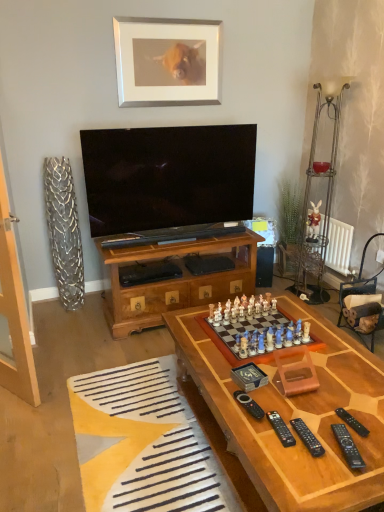
Identify the location of empty space that is ontop of silver/metallic picture frame at upper center (from a real-world perspective). The width and height of the screenshot is (384, 512). (168, 17).